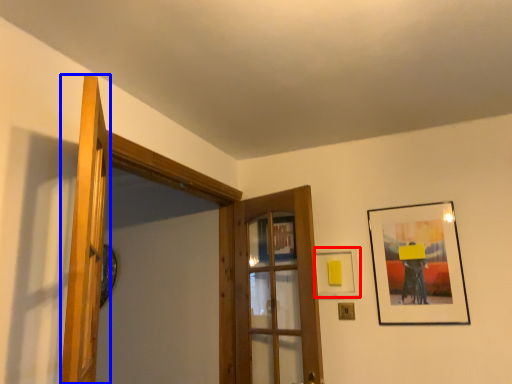
Question: Which object appears farthest to the camera in this image, picture frame (highlighted by a red box) or door (highlighted by a blue box)?

Choices:
 (A) picture frame
 (B) door

Answer: (A)